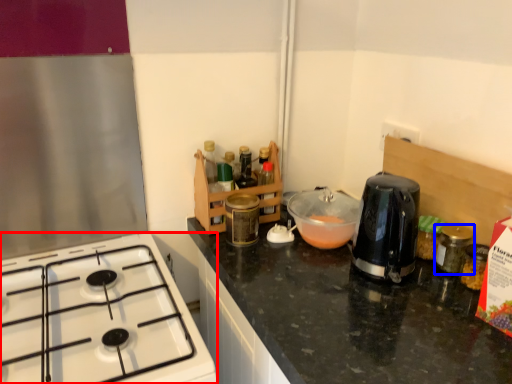
Question: Which object appears farthest to the camera in this image, gas stove (highlighted by a red box) or bottle (highlighted by a blue box)?

Choices:
 (A) gas stove
 (B) bottle

Answer: (B)